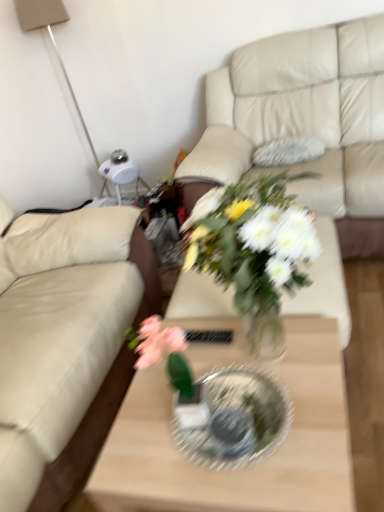
What do you see at coordinates (305, 122) in the screenshot?
I see `beige leather couch at upper center, which is counted as the 1th studio couch, starting from the right` at bounding box center [305, 122].

Find the location of `beige leather couch at upper center, which is the second studio couch in left-to-right order`. beige leather couch at upper center, which is the second studio couch in left-to-right order is located at coordinates (305, 122).

The width and height of the screenshot is (384, 512). In order to click on clear glass coffee table at center in this screenshot , I will do `click(242, 468)`.

What do you see at coordinates (72, 336) in the screenshot? The width and height of the screenshot is (384, 512). I see `beige leather couch at left, acting as the second studio couch starting from the right` at bounding box center [72, 336].

Image resolution: width=384 pixels, height=512 pixels. Describe the element at coordinates (51, 40) in the screenshot. I see `matte white lamp at upper left` at that location.

You are a GUI agent. You are given a task and a screenshot of the screen. Output one action in this format:
    pyautogui.click(x=<x>, y=<y>)
    Task: Click on the clear glass plate at center
    Image resolution: width=384 pixels, height=512 pixels.
    Given the screenshot: What is the action you would take?
    pyautogui.click(x=233, y=418)

Identify the location of beige leather couch at upper center, which is the second studio couch in left-to-right order. The image size is (384, 512). (305, 122).

In the scene shown: Considering the relative sizes of matte white lamp at upper left and clear glass coffee table at center in the image provided, is matte white lamp at upper left shorter than clear glass coffee table at center?

No.

Are matte white lamp at upper left and clear glass coffee table at center making contact?

No, matte white lamp at upper left is not making contact with clear glass coffee table at center.

Based on the photo, from a real-world perspective, between matte white lamp at upper left and clear glass coffee table at center, who is vertically lower?

clear glass coffee table at center is physically lower.

Identify the location of table lamp above the clear glass coffee table at center (from a real-world perspective). The image size is (384, 512). point(51,40).

Would you consider beige leather couch at upper center, which is counted as the 1th studio couch, starting from the right, to be distant from matte white lamp at upper left?

Yes, beige leather couch at upper center, which is counted as the 1th studio couch, starting from the right, and matte white lamp at upper left are located far from each other.

How distant is beige leather couch at upper center, which is counted as the 1th studio couch, starting from the right, from matte white lamp at upper left?

beige leather couch at upper center, which is counted as the 1th studio couch, starting from the right, is 4.98 feet away from matte white lamp at upper left.

From the image's perspective, is beige leather couch at upper center, which is counted as the 1th studio couch, starting from the right, positioned above or below matte white lamp at upper left?

From the image's perspective, beige leather couch at upper center, which is counted as the 1th studio couch, starting from the right, appears below matte white lamp at upper left.

Which is in front, beige leather couch at upper center, which is the second studio couch in left-to-right order, or matte white lamp at upper left?

beige leather couch at upper center, which is the second studio couch in left-to-right order.

From the picture: Considering the sizes of objects clear glass coffee table at center and translucent glass vase at center in the image provided, who is thinner, clear glass coffee table at center or translucent glass vase at center?

Thinner between the two is translucent glass vase at center.

Could you tell me if clear glass coffee table at center is facing translucent glass vase at center?

No, clear glass coffee table at center does not turn towards translucent glass vase at center.

Between clear glass coffee table at center and translucent glass vase at center, which one is positioned behind?

clear glass coffee table at center is more distant.

Can you confirm if clear glass coffee table at center is positioned to the left of translucent glass vase at center?

Indeed, clear glass coffee table at center is positioned on the left side of translucent glass vase at center.

Consider the image. Measure the distance between translucent glass vase at center and clear glass plate at center.

translucent glass vase at center and clear glass plate at center are 10.28 inches apart from each other.

Considering the positions of objects translucent glass vase at center and clear glass plate at center in the image provided, who is more to the left, translucent glass vase at center or clear glass plate at center?

Positioned to the left is clear glass plate at center.

Consider the image. What's the angular difference between translucent glass vase at center and clear glass plate at center's facing directions?

translucent glass vase at center and clear glass plate at center are facing 2.01 degrees away from each other.

From the image's perspective, between translucent glass vase at center and clear glass plate at center, who is located below?

From the image's view, clear glass plate at center is below.

From a real-world perspective, who is located lower, beige leather couch at upper center, which is counted as the 1th studio couch, starting from the right, or translucent glass vase at center?

From a 3D spatial view, beige leather couch at upper center, which is counted as the 1th studio couch, starting from the right, is below.

Which point is more distant from viewer, (373,162) or (235,274)?

The point (373,162) is more distant.

Is beige leather couch at upper center, which is counted as the 1th studio couch, starting from the right, aimed at translucent glass vase at center?

Yes, beige leather couch at upper center, which is counted as the 1th studio couch, starting from the right, is aimed at translucent glass vase at center.

Between beige leather couch at upper center, which is the second studio couch in left-to-right order, and translucent glass vase at center, which one has smaller width?

translucent glass vase at center.

Is matte white lamp at upper left not close to translucent glass vase at center?

Absolutely, matte white lamp at upper left is distant from translucent glass vase at center.

From the image's perspective, is matte white lamp at upper left located above translucent glass vase at center?

Yes.

Is matte white lamp at upper left oriented away from translucent glass vase at center?

No, matte white lamp at upper left is not facing the opposite direction of translucent glass vase at center.

Does clear glass plate at center have a lesser width compared to beige leather couch at left, the first studio couch from the left?

Correct, the width of clear glass plate at center is less than that of beige leather couch at left, the first studio couch from the left.

Considering their positions, is clear glass plate at center located in front of or behind beige leather couch at left, the first studio couch from the left?

Clearly, clear glass plate at center is in front of beige leather couch at left, the first studio couch from the left.

Are clear glass plate at center and beige leather couch at left, acting as the second studio couch starting from the right, far apart?

Actually, clear glass plate at center and beige leather couch at left, acting as the second studio couch starting from the right, are a little close together.

Where is `coffee table located in front of the matte white lamp at upper left`? The width and height of the screenshot is (384, 512). coffee table located in front of the matte white lamp at upper left is located at coordinates (242, 468).

There is a matte white lamp at upper left. At what (x,y) coordinates should I click in order to perform the action: click on the 1st studio couch below it (from a real-world perspective). Please return your answer as a coordinate pair (x, y). Image resolution: width=384 pixels, height=512 pixels. Looking at the image, I should click on [x=305, y=122].

Considering their positions, is matte white lamp at upper left positioned further to clear glass coffee table at center than clear glass plate at center?

Based on the image, matte white lamp at upper left appears to be further to clear glass coffee table at center.

From the image, which object appears to be nearer to beige leather couch at left, acting as the second studio couch starting from the right, clear glass coffee table at center or clear glass plate at center?

clear glass coffee table at center is closer to beige leather couch at left, acting as the second studio couch starting from the right.

From the image, which object appears to be farther from clear glass coffee table at center, clear glass plate at center or beige leather couch at left, acting as the second studio couch starting from the right?

Based on the image, beige leather couch at left, acting as the second studio couch starting from the right, appears to be further to clear glass coffee table at center.

Looking at the image, which one is located further to beige leather couch at upper center, which is counted as the 1th studio couch, starting from the right, clear glass coffee table at center or clear glass plate at center?

The object further to beige leather couch at upper center, which is counted as the 1th studio couch, starting from the right, is clear glass plate at center.

When comparing their distances from translucent glass vase at center, does beige leather couch at left, acting as the second studio couch starting from the right, or clear glass plate at center seem closer?

Among the two, clear glass plate at center is located nearer to translucent glass vase at center.

From the image, which object appears to be farther from clear glass coffee table at center, matte white lamp at upper left or translucent glass vase at center?

matte white lamp at upper left is further to clear glass coffee table at center.

Estimate the real-world distances between objects in this image. Which object is closer to beige leather couch at upper center, which is the second studio couch in left-to-right order, clear glass plate at center or matte white lamp at upper left?

The object closer to beige leather couch at upper center, which is the second studio couch in left-to-right order, is clear glass plate at center.

From the image, which object appears to be nearer to translucent glass vase at center, clear glass plate at center or beige leather couch at upper center, which is counted as the 1th studio couch, starting from the right?

clear glass plate at center is closer to translucent glass vase at center.

This screenshot has width=384, height=512. I want to click on coffee table located between beige leather couch at left, acting as the second studio couch starting from the right, and translucent glass vase at center in the left-right direction, so click(242, 468).

I want to click on round table located between beige leather couch at left, the first studio couch from the left, and clear glass coffee table at center in the left-right direction, so click(233, 418).

Find the location of a particular element. houseplant between beige leather couch at left, the first studio couch from the left, and beige leather couch at upper center, which is the second studio couch in left-to-right order, from left to right is located at coordinates (254, 252).

Where is `round table located between beige leather couch at left, the first studio couch from the left, and translucent glass vase at center in the left-right direction`? This screenshot has height=512, width=384. round table located between beige leather couch at left, the first studio couch from the left, and translucent glass vase at center in the left-right direction is located at coordinates (233, 418).